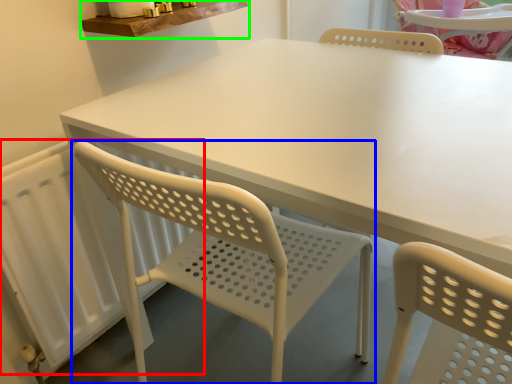
Question: Which is farther away from radiator (highlighted by a red box)? chair (highlighted by a blue box) or counter top (highlighted by a green box)?

Choices:
 (A) chair
 (B) counter top

Answer: (B)